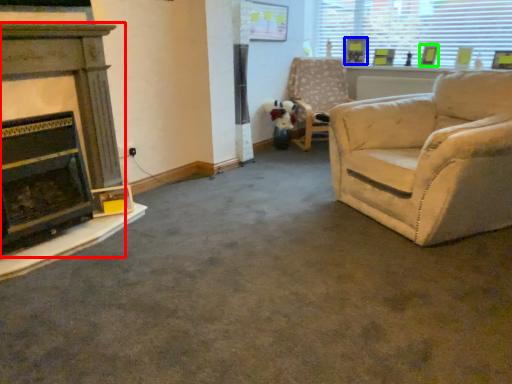
Question: Which object is positioned closest to fireplace (highlighted by a red box)? Select from picture frame (highlighted by a blue box) and picture frame (highlighted by a green box).

Choices:
 (A) picture frame
 (B) picture frame

Answer: (A)